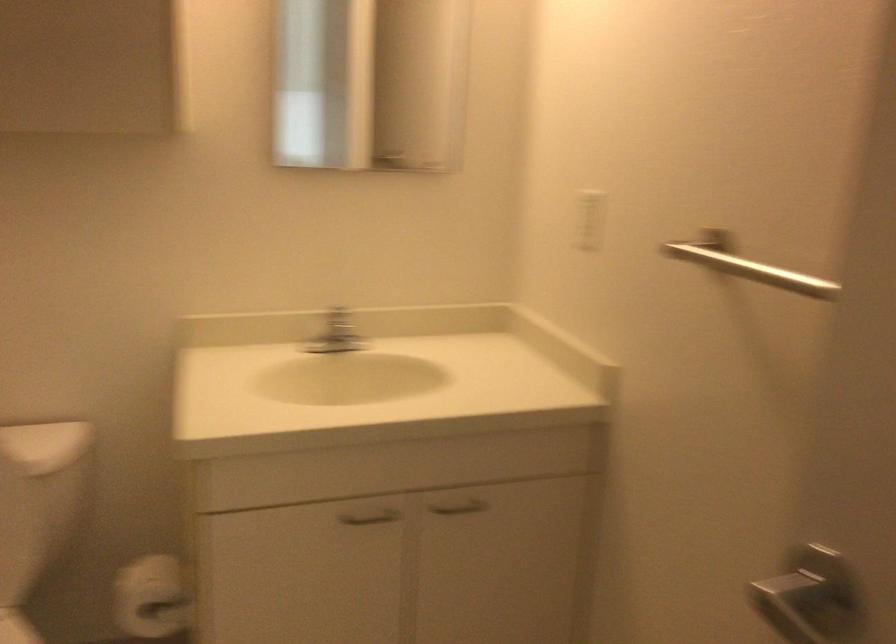
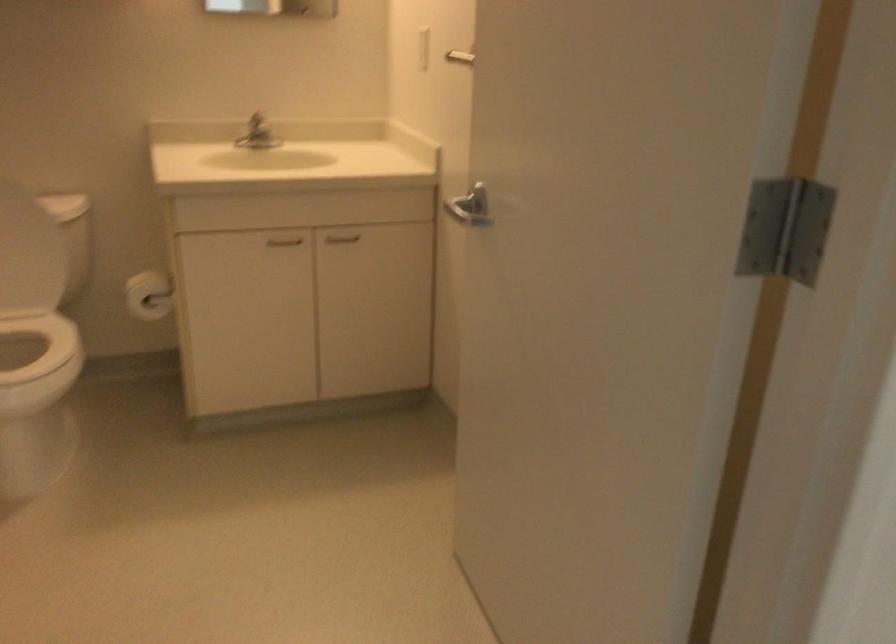
The point at (x=460, y=514) is marked in the first image. Where is the corresponding point in the second image?

(341, 238)